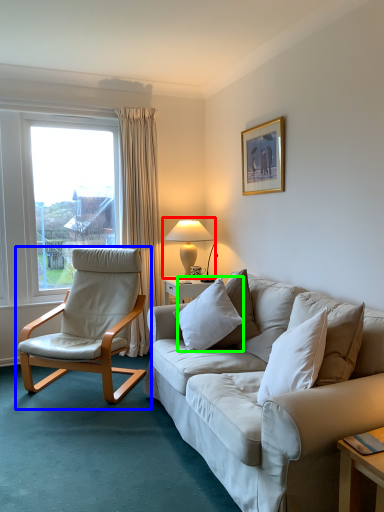
Question: Estimate the real-world distances between objects in this image. Which object is closer to table lamp (highlighted by a red box), chair (highlighted by a blue box) or pillow (highlighted by a green box)?

Choices:
 (A) chair
 (B) pillow

Answer: (A)